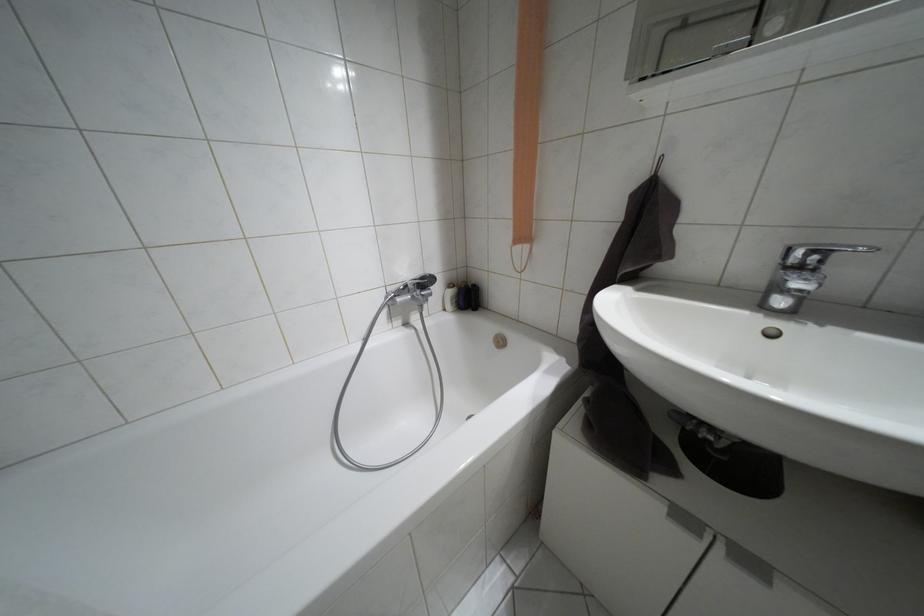
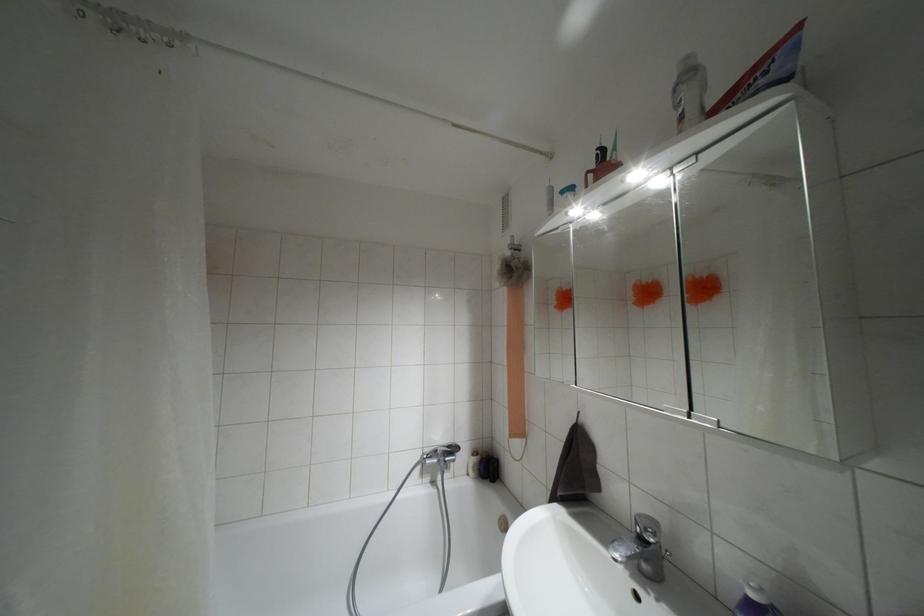
Locate, in the second image, the point that corresponds to point (797, 269) in the first image.

(641, 538)